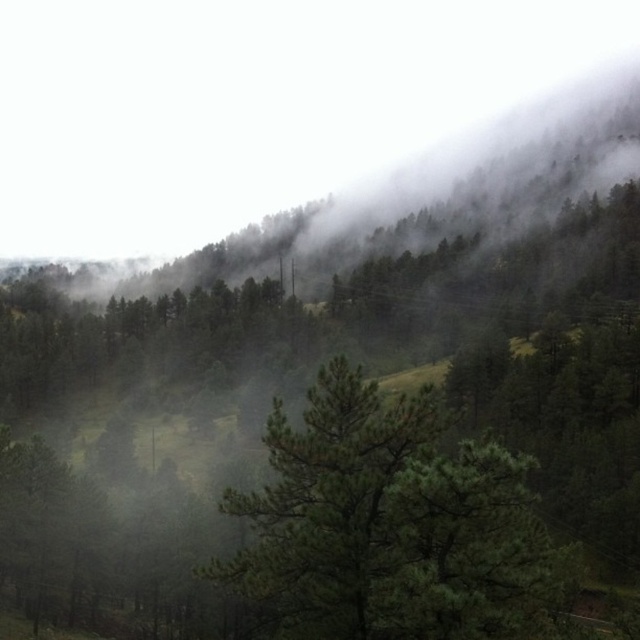
Which is below, foggy mist at upper center or green matte tree at center?

green matte tree at center is lower down.

Who is more distant from viewer, (262, 90) or (374, 573)?

Positioned behind is point (262, 90).

Between point (227, 3) and point (240, 493), which one is positioned behind?

The point (227, 3) is behind.

Locate an element on the screen. This screenshot has width=640, height=640. foggy mist at upper center is located at coordinates (273, 113).